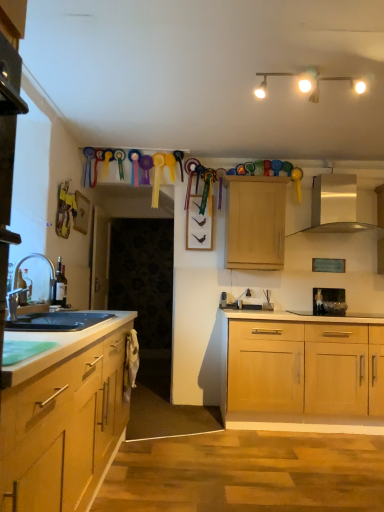
You are a GUI agent. You are given a task and a screenshot of the screen. Output one action in this format:
    pyautogui.click(x=<x>, y=<y>)
    Task: Click on the blank space above white matte track lights at upper center (from a real-world perspective)
    
    Given the screenshot: What is the action you would take?
    (317, 65)